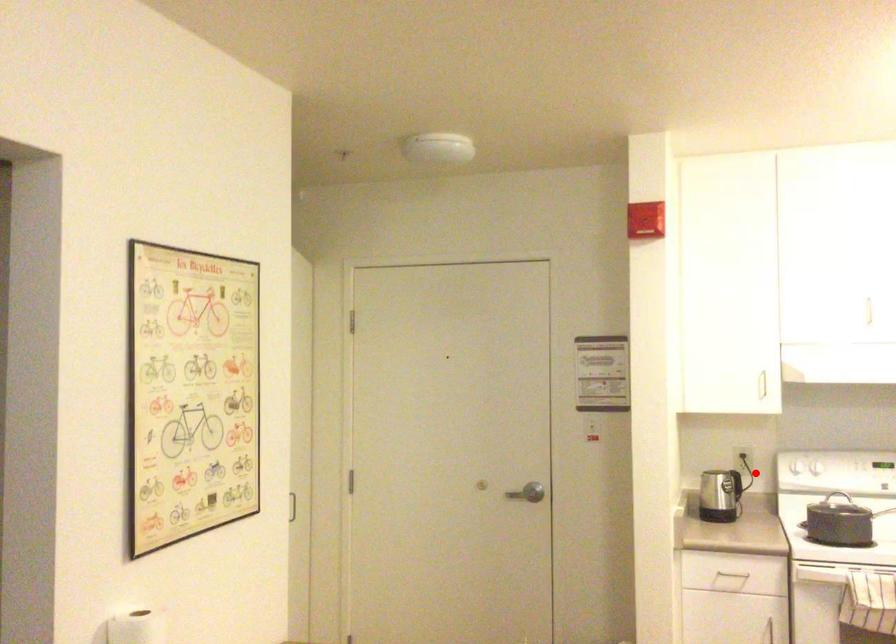
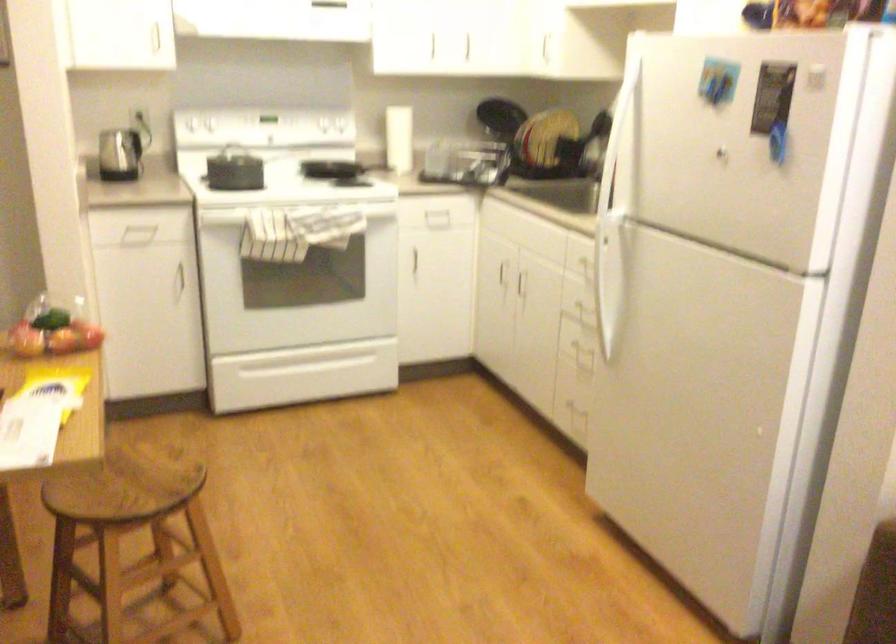
Where in the second image is the point corresponding to the highlighted location from the first image?

(149, 131)